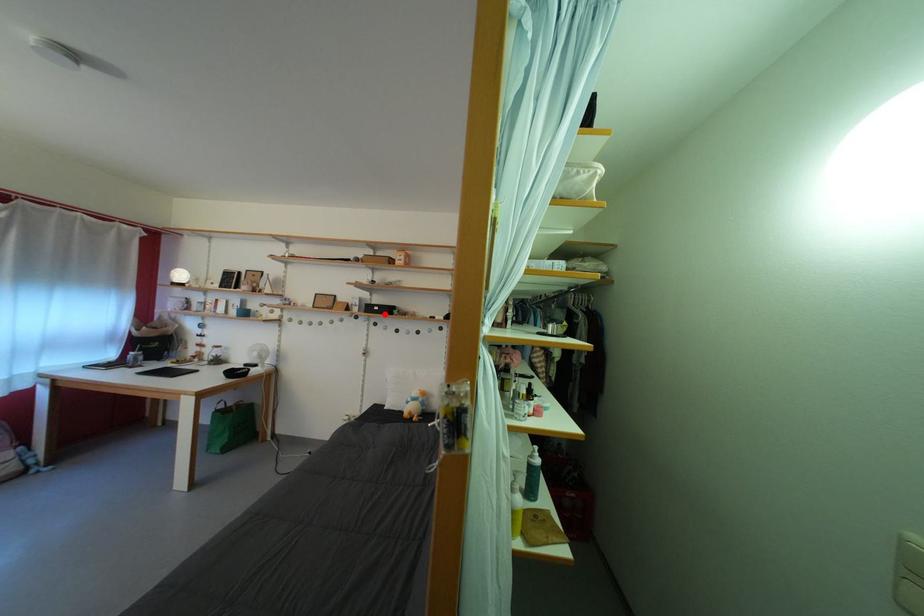
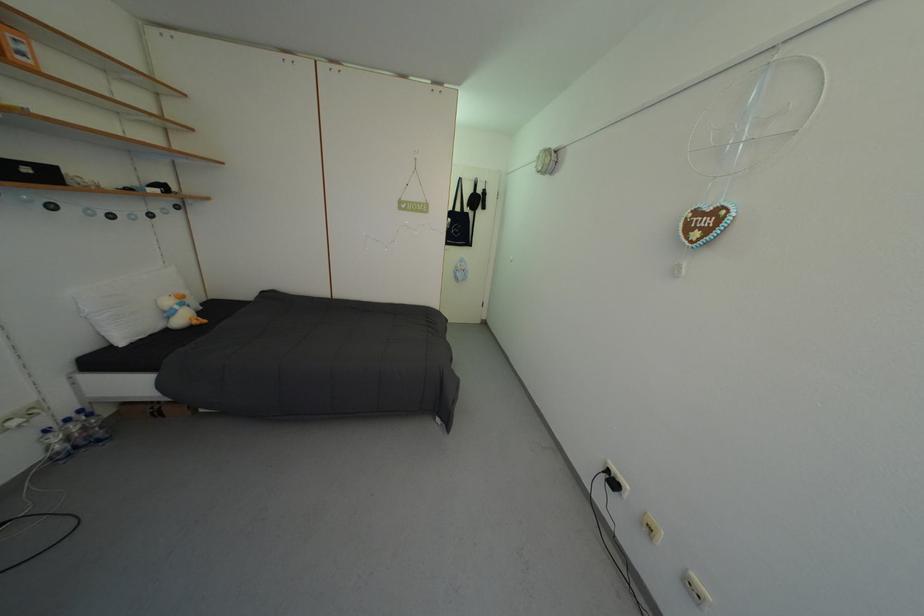
Where in the second image is the point corresponding to the highlighted location from the first image?

(35, 176)